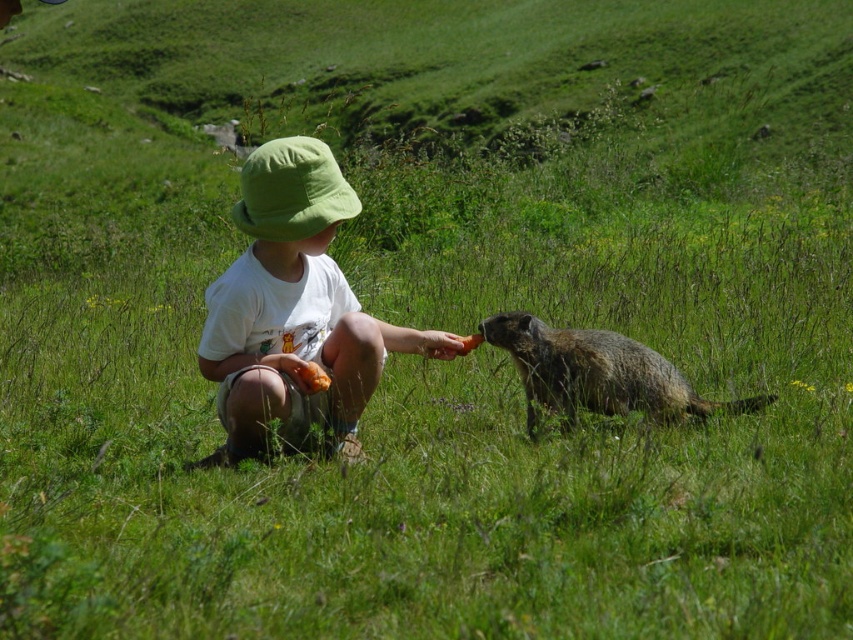
Question: Does white cotton shirt at center have a smaller size compared to green fabric hat at center?

Choices:
 (A) yes
 (B) no

Answer: (B)

Question: Is white cotton shirt at center further to the viewer compared to brown furry groundhog at lower right?

Choices:
 (A) no
 (B) yes

Answer: (A)

Question: Which point is closer to the camera?

Choices:
 (A) brown furry groundhog at lower right
 (B) green fabric hat at center
 (C) white cotton shirt at center

Answer: (C)

Question: Which of these objects is positioned closest to the brown furry groundhog at lower right?

Choices:
 (A) green fabric hat at center
 (B) white cotton shirt at center

Answer: (B)

Question: Which of these objects is positioned farthest from the brown furry groundhog at lower right?

Choices:
 (A) green fabric hat at center
 (B) white cotton shirt at center

Answer: (A)

Question: Is white cotton shirt at center to the right of brown furry groundhog at lower right from the viewer's perspective?

Choices:
 (A) no
 (B) yes

Answer: (A)